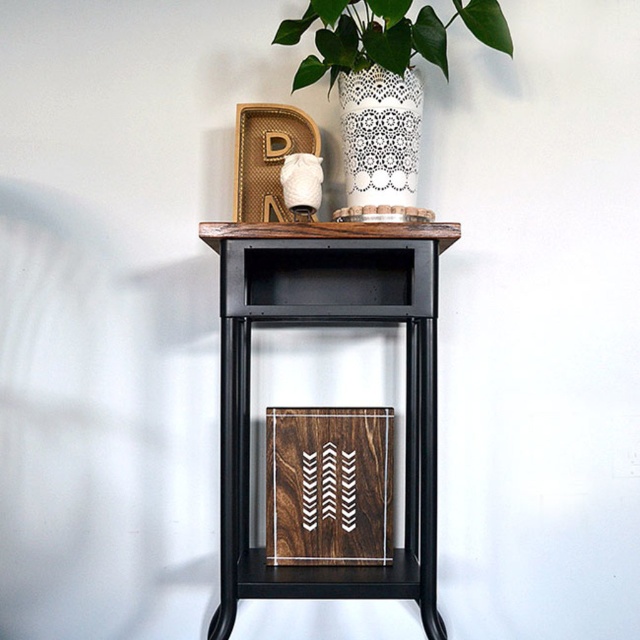
Between wooden cutting board at center and white lace glass vase at upper center, which one is positioned higher?

white lace glass vase at upper center is above.

Does wooden cutting board at center have a lesser height compared to white lace glass vase at upper center?

In fact, wooden cutting board at center may be taller than white lace glass vase at upper center.

What do you see at coordinates (328, 324) in the screenshot? I see `wooden cutting board at center` at bounding box center [328, 324].

This screenshot has height=640, width=640. Identify the location of wooden cutting board at center. (328, 324).

What do you see at coordinates (328, 324) in the screenshot? I see `wooden cutting board at center` at bounding box center [328, 324].

Who is more distant from viewer, (230, 561) or (330, 83)?

Point (330, 83)

Is point (236, 570) farther from camera compared to point (337, 38)?

No.

This screenshot has height=640, width=640. In order to click on wooden cutting board at center in this screenshot , I will do `click(328, 324)`.

Where is `white lace vase at upper center`? The width and height of the screenshot is (640, 640). white lace vase at upper center is located at coordinates (385, 35).

Can you confirm if white lace vase at upper center is positioned to the right of white lace glass vase at upper center?

Indeed, white lace vase at upper center is positioned on the right side of white lace glass vase at upper center.

Is point (417, 38) in front of point (349, 108)?

Yes, point (417, 38) is in front of point (349, 108).

Where is `white lace vase at upper center`? The image size is (640, 640). white lace vase at upper center is located at coordinates (385, 35).